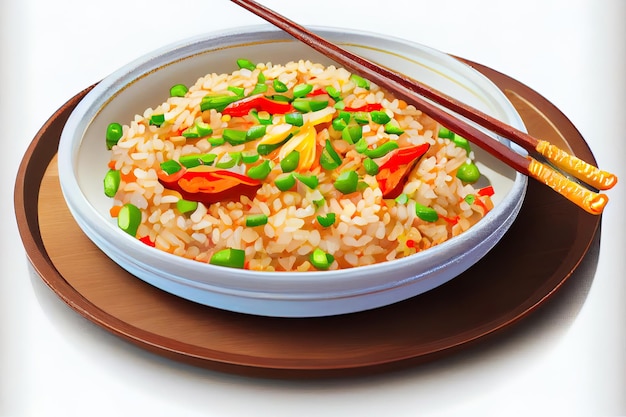
This screenshot has height=417, width=626. In order to click on white dish in this screenshot , I will do `click(342, 300)`.